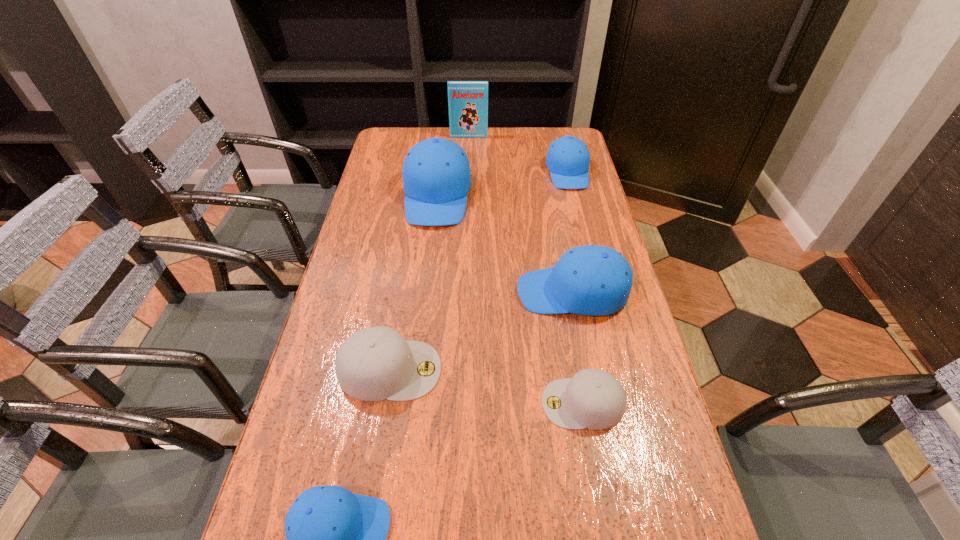
Find the location of `vacant space located on the front-facing side of the tallest cap`. vacant space located on the front-facing side of the tallest cap is located at coordinates (424, 305).

At what (x,y) coordinates should I click in order to perform the action: click on vacant region located 0.350m on the front-facing side of the fourth nearest cap. Please return your answer as a coordinate pair (x, y). Image resolution: width=960 pixels, height=540 pixels. Looking at the image, I should click on (389, 292).

What are the coordinates of `free region located on the front-facing side of the fourth nearest cap` in the screenshot? It's located at (484, 292).

Find the location of a particular element. free space located on the front-facing side of the fourth nearest cap is located at coordinates (455, 292).

Identify the location of vacant space located 0.240m on the front-facing side of the second smallest blue cap. (584, 237).

Where is `free region located on the front-facing side of the bigger gray cap`? free region located on the front-facing side of the bigger gray cap is located at coordinates (531, 369).

Locate an element on the screen. The width and height of the screenshot is (960, 540). blank space located 0.180m on the front-facing side of the smaller gray cap is located at coordinates (461, 403).

Where is `free space located on the front-facing side of the smaller gray cap`? The image size is (960, 540). free space located on the front-facing side of the smaller gray cap is located at coordinates (474, 403).

Locate an element on the screen. The image size is (960, 540). blank area located on the front-facing side of the smaller gray cap is located at coordinates (374, 403).

This screenshot has width=960, height=540. I want to click on book located in the far edge section of the desktop, so (467, 100).